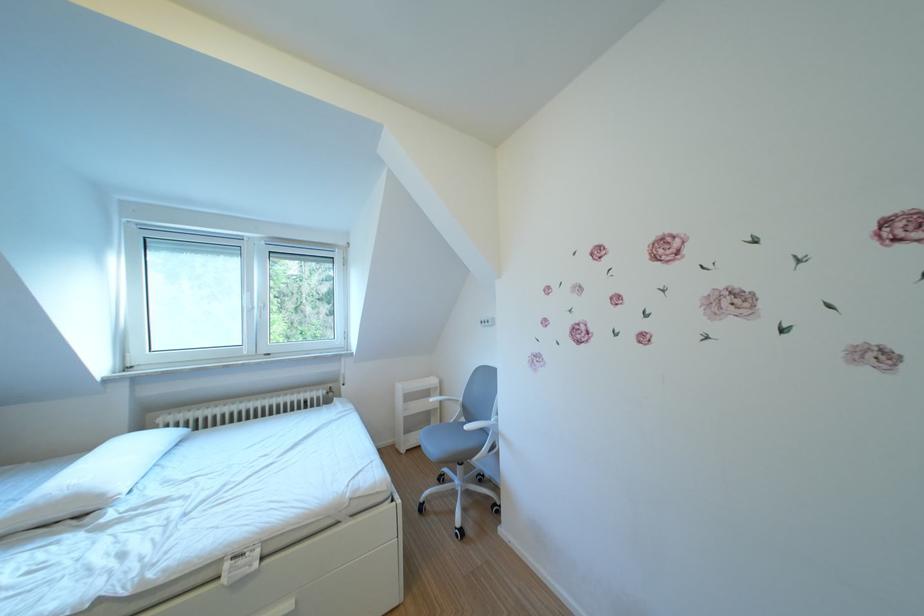
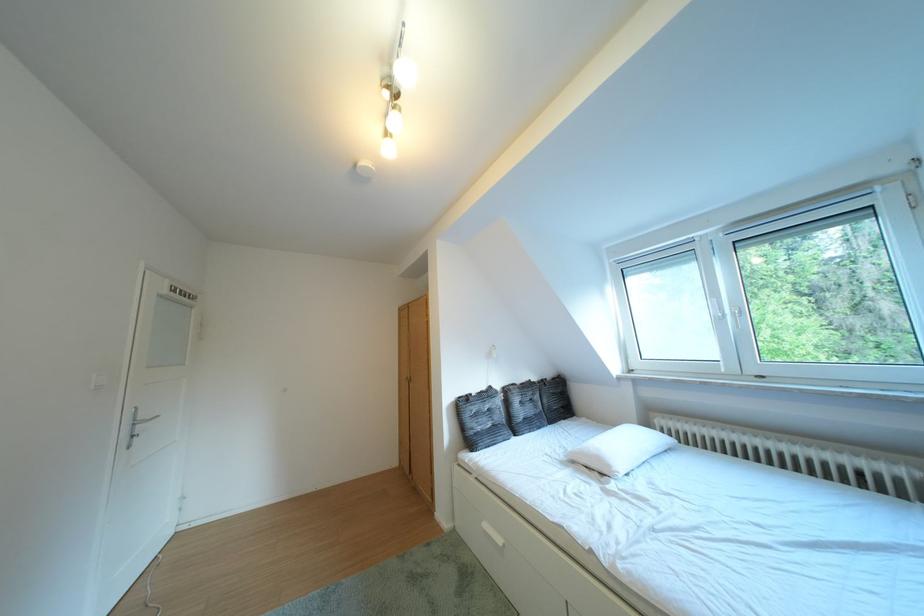
Where in the second image is the point corresponding to (x=265, y=307) from the first image?

(736, 315)